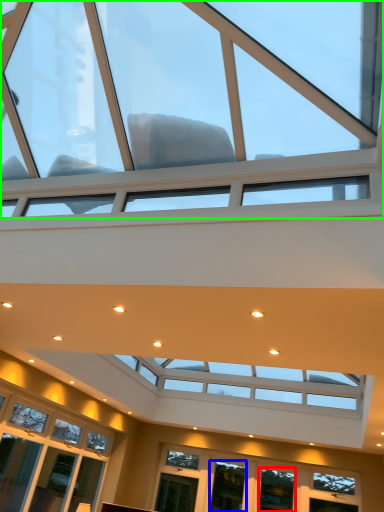
Question: Considering the real-world distances, which object is closest to window (highlighted by a red box)? window (highlighted by a blue box) or window (highlighted by a green box).

Choices:
 (A) window
 (B) window

Answer: (A)